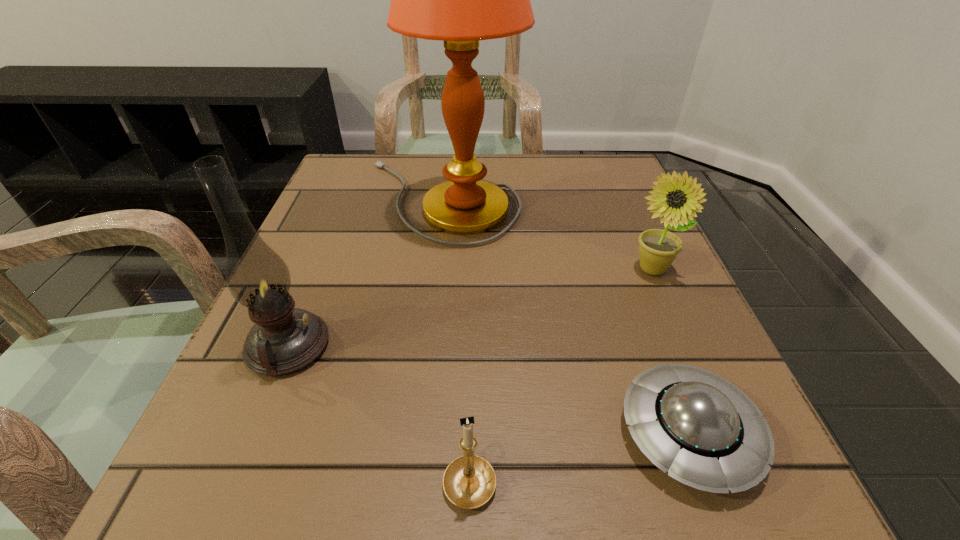
Locate an element on the screen. This screenshot has height=540, width=960. vacant space in between the third tallest object and the second tallest object is located at coordinates (469, 308).

At what (x,y) coordinates should I click in order to perform the action: click on free space between the third shortest object and the second shortest object. Please return your answer as a coordinate pair (x, y). Looking at the image, I should click on (561, 374).

Where is `vacant space that's between the second tallest object and the shortest object`? vacant space that's between the second tallest object and the shortest object is located at coordinates (489, 390).

Where is `vacant area between the saucer and the farthest object`? The width and height of the screenshot is (960, 540). vacant area between the saucer and the farthest object is located at coordinates (565, 317).

This screenshot has width=960, height=540. I want to click on vacant area that lies between the second shortest object and the oil lamp, so click(379, 412).

Image resolution: width=960 pixels, height=540 pixels. Find the location of `unoccupied position between the fourth shortest object and the farthest object`. unoccupied position between the fourth shortest object and the farthest object is located at coordinates (365, 274).

You are a GUI agent. You are given a task and a screenshot of the screen. Output one action in this format:
    pyautogui.click(x=<x>, y=<y>)
    Task: Click on the free spot between the lamp and the saucer
    This screenshot has height=540, width=960.
    Given the screenshot: What is the action you would take?
    pyautogui.click(x=565, y=317)

What are the coordinates of `vacant area between the oil lamp and the saucer` in the screenshot? It's located at (489, 390).

Locate an element on the screen. This screenshot has height=540, width=960. free spot between the fourth shortest object and the saucer is located at coordinates (489, 390).

Where is `free space between the shortest object and the farthest object`? The width and height of the screenshot is (960, 540). free space between the shortest object and the farthest object is located at coordinates (565, 317).